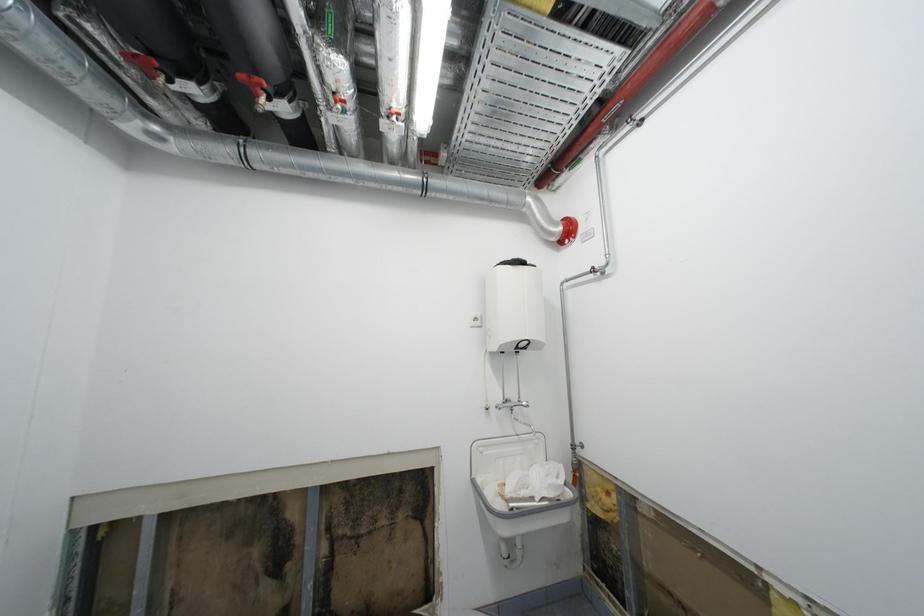
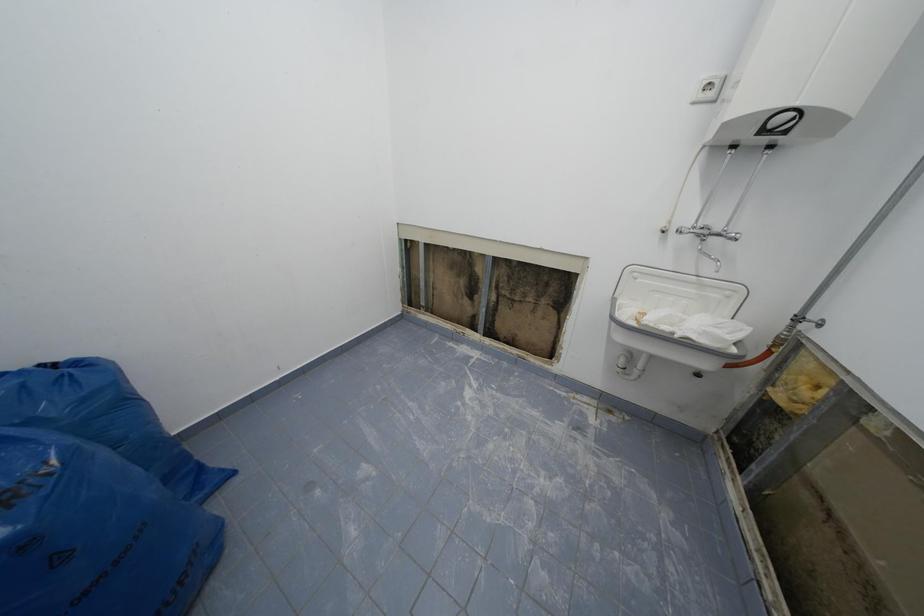
The images are taken continuously from a first-person perspective. In which direction is your viewpoint rotating?

The camera rotated toward left-down.